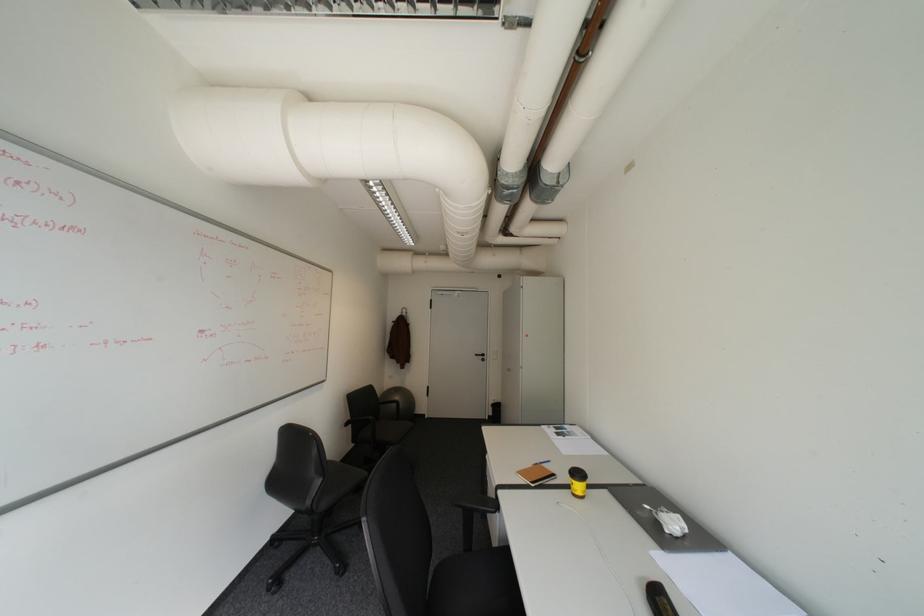
Where would you turn the black door handle? Please return your answer as a coordinate pair (x, y).

(480, 355)